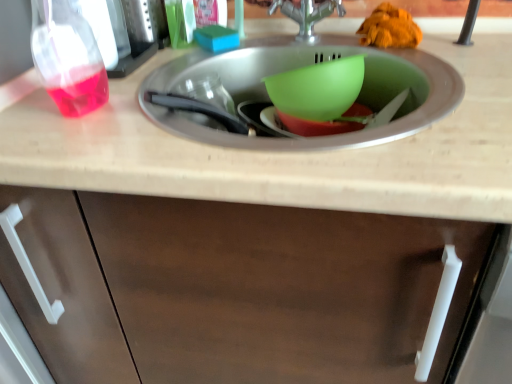
Question: Which direction should I rotate to look at green plastic bowl at center, which is counted as the 1th basin, starting from the bottom?

Choices:
 (A) right
 (B) left

Answer: (A)

Question: Is the position of silver metallic tap at center more distant than that of beige laminate countertop at center?

Choices:
 (A) yes
 (B) no

Answer: (A)

Question: From a real-world perspective, is silver metallic tap at center on beige laminate countertop at center?

Choices:
 (A) no
 (B) yes

Answer: (B)

Question: Can you confirm if silver metallic tap at center is thinner than beige laminate countertop at center?

Choices:
 (A) no
 (B) yes

Answer: (B)

Question: Does silver metallic tap at center have a larger size compared to beige laminate countertop at center?

Choices:
 (A) yes
 (B) no

Answer: (B)

Question: Is beige laminate countertop at center at the back of silver metallic tap at center?

Choices:
 (A) yes
 (B) no

Answer: (B)

Question: Does silver metallic tap at center come in front of beige laminate countertop at center?

Choices:
 (A) no
 (B) yes

Answer: (A)

Question: Is beige laminate countertop at center at the left side of green plastic bowl at center, which ranks as the second basin in top-to-bottom order?

Choices:
 (A) no
 (B) yes

Answer: (B)

Question: From a real-world perspective, does beige laminate countertop at center sit lower than green plastic bowl at center, which ranks as the second basin in top-to-bottom order?

Choices:
 (A) yes
 (B) no

Answer: (B)

Question: Does beige laminate countertop at center come behind green plastic bowl at center, which is counted as the 1th basin, starting from the bottom?

Choices:
 (A) no
 (B) yes

Answer: (A)

Question: From the image's perspective, would you say beige laminate countertop at center is shown under green plastic bowl at center, which is counted as the 1th basin, starting from the bottom?

Choices:
 (A) yes
 (B) no

Answer: (B)

Question: Could you tell me if beige laminate countertop at center is turned towards green plastic bowl at center, which is counted as the 1th basin, starting from the bottom?

Choices:
 (A) no
 (B) yes

Answer: (A)

Question: Does beige laminate countertop at center contain green plastic bowl at center, which is counted as the 1th basin, starting from the bottom?

Choices:
 (A) no
 (B) yes

Answer: (B)

Question: Does silver metallic tap at center have a lesser width compared to blue sponge at upper center, the 1th food positioned from the left?

Choices:
 (A) no
 (B) yes

Answer: (A)